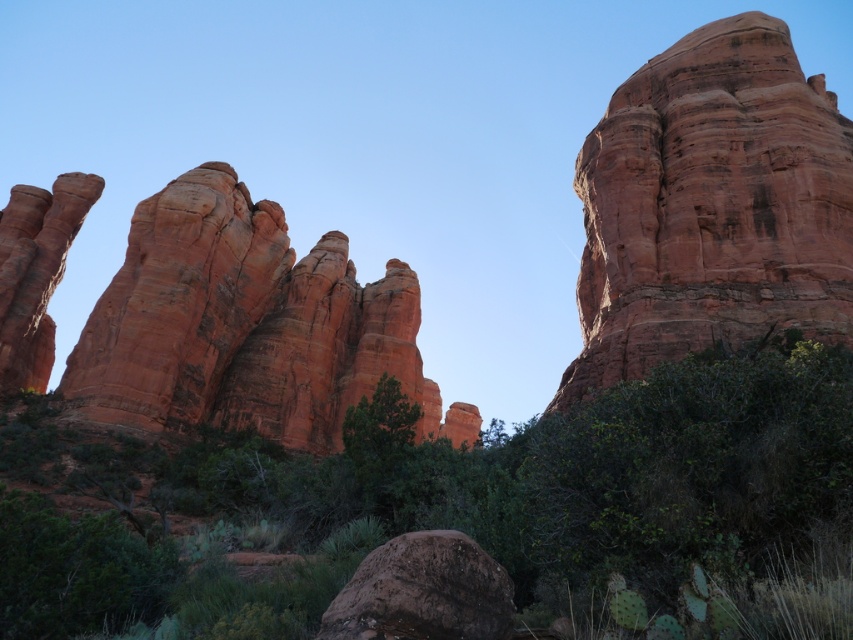
Question: Which of the following is the farthest from the observer?

Choices:
 (A) rustic sandstone rock formation at left
 (B) rustic sandstone rock formation at upper right

Answer: (A)

Question: Can you confirm if rustic sandstone rock formation at upper right is positioned to the right of brown rough boulder at center?

Choices:
 (A) no
 (B) yes

Answer: (B)

Question: Which point is farther to the camera?

Choices:
 (A) (131, 248)
 (B) (682, 163)
 (C) (405, 572)

Answer: (A)

Question: Is rustic sandstone rock formation at upper right further to camera compared to brown rough boulder at center?

Choices:
 (A) no
 (B) yes

Answer: (B)

Question: Does rustic sandstone rock formation at upper right appear over brown rough boulder at center?

Choices:
 (A) no
 (B) yes

Answer: (B)

Question: Which of these objects is positioned farthest from the brown rough boulder at center?

Choices:
 (A) rustic sandstone rock formation at upper right
 (B) rustic sandstone rock formation at left

Answer: (B)